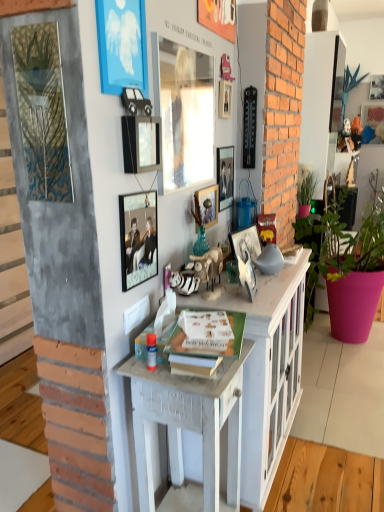
Question: In terms of width, does matte glass picture frame at center, the fifth picture frame viewed from the right, look wider or thinner when compared to green matte plant at right, arranged as the second houseplant when viewed from the right?

Choices:
 (A) wide
 (B) thin

Answer: (B)

Question: Is matte glass picture frame at center, the fifth picture frame viewed from the right, taller or shorter than green matte plant at right, which ranks as the 1th houseplant in left-to-right order?

Choices:
 (A) short
 (B) tall

Answer: (A)

Question: Which is nearer to the metallic silver picture frame at center, the third picture frame viewed from the left?

Choices:
 (A) wooden picture frame at upper right, positioned as the second picture frame in right-to-left order
 (B) matte glass picture frame at upper center, positioned as the fifth picture frame in front-to-back order
 (C) white wood cabinet at center
 (D) metallic silver picture frame at upper center, the 4th picture frame positioned from the left
 (E) wooden desk at center

Answer: (D)

Question: Which is nearer to the wooden picture frame at upper right, the 9th picture frame viewed from the left?

Choices:
 (A) pink matte pot at right, which appears as the second houseplant when viewed from the left
 (B) matte glass picture frame at upper center, which is the 6th picture frame from back to front
 (C) green matte plant at right, arranged as the second houseplant when viewed from the right
 (D) white wood cabinet at center
 (E) metallic gold picture frame at left, which is counted as the 10th picture frame, starting from the back

Answer: (C)